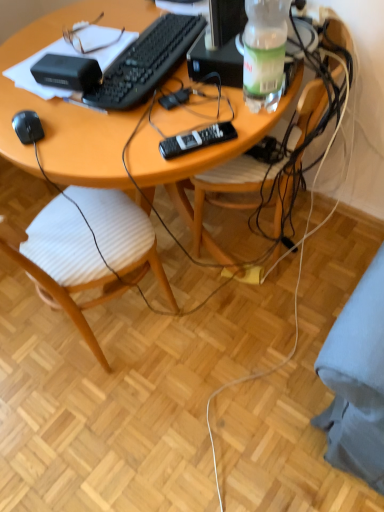
This screenshot has width=384, height=512. I want to click on vacant space to the right of black plastic remote at center, so click(253, 119).